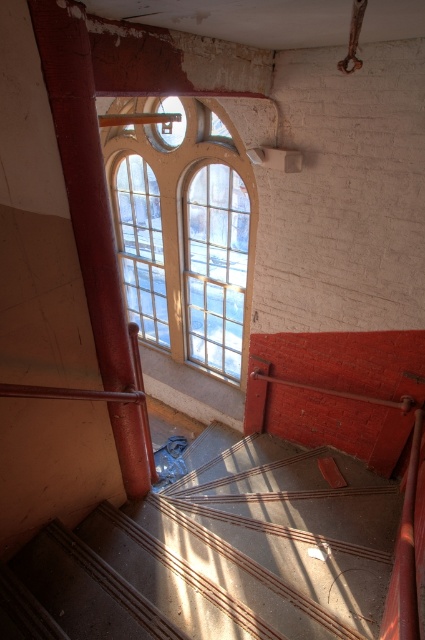
Question: Can you confirm if concrete textured stairs at center is bigger than clear glass window at center?

Choices:
 (A) no
 (B) yes

Answer: (A)

Question: Does concrete textured stairs at center have a greater width compared to clear glass window at center?

Choices:
 (A) no
 (B) yes

Answer: (B)

Question: Which point is farther to the camera?

Choices:
 (A) clear glass window at center
 (B) concrete textured stairs at center

Answer: (A)

Question: Does concrete textured stairs at center have a greater width compared to clear glass window at center?

Choices:
 (A) yes
 (B) no

Answer: (A)

Question: Which point is closer to the camera taking this photo?

Choices:
 (A) pyautogui.click(x=139, y=237)
 (B) pyautogui.click(x=47, y=593)

Answer: (B)

Question: Among these points, which one is nearest to the camera?

Choices:
 (A) (129, 234)
 (B) (147, 570)

Answer: (B)